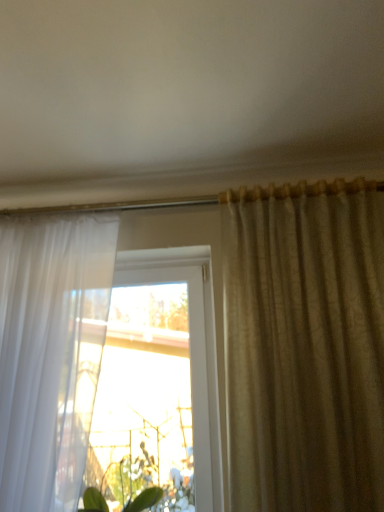
Question: Looking at the image, does satin beige curtain at right, acting as the second curtain starting from the left, seem bigger or smaller compared to transparent glass window at center?

Choices:
 (A) small
 (B) big

Answer: (B)

Question: Is point coord(264,499) positioned closer to the camera than point coord(177,483)?

Choices:
 (A) closer
 (B) farther

Answer: (A)

Question: Which of these objects is positioned farthest from the transparent glass window at center?

Choices:
 (A) green leafy plant at lower center
 (B) satin beige curtain at right, acting as the second curtain starting from the left
 (C) white sheer curtain at left, the first curtain in the left-to-right sequence

Answer: (B)

Question: Considering the real-world distances, which object is farthest from the white sheer curtain at left, the first curtain in the left-to-right sequence?

Choices:
 (A) satin beige curtain at right, acting as the second curtain starting from the left
 (B) transparent glass window at center
 (C) green leafy plant at lower center

Answer: (A)